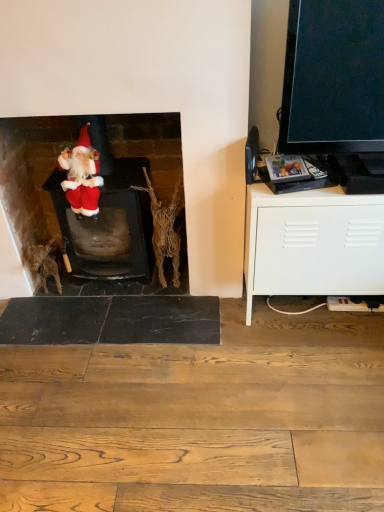
Question: Considering the relative sizes of velvet santa at left and fuzzy fabric santa at left in the image provided, is velvet santa at left wider than fuzzy fabric santa at left?

Choices:
 (A) yes
 (B) no

Answer: (A)

Question: Is velvet santa at left behind fuzzy fabric santa at left?

Choices:
 (A) no
 (B) yes

Answer: (B)

Question: Is velvet santa at left not inside fuzzy fabric santa at left?

Choices:
 (A) no
 (B) yes

Answer: (B)

Question: Considering the relative positions of velvet santa at left and fuzzy fabric santa at left in the image provided, is velvet santa at left in front of fuzzy fabric santa at left?

Choices:
 (A) no
 (B) yes

Answer: (A)

Question: Is velvet santa at left touching fuzzy fabric santa at left?

Choices:
 (A) yes
 (B) no

Answer: (B)

Question: From the image's perspective, is fuzzy fabric santa at left above or below velvet santa at left?

Choices:
 (A) below
 (B) above

Answer: (B)

Question: Based on their sizes in the image, would you say fuzzy fabric santa at left is bigger or smaller than velvet santa at left?

Choices:
 (A) big
 (B) small

Answer: (B)

Question: Choose the correct answer: Is fuzzy fabric santa at left inside velvet santa at left or outside it?

Choices:
 (A) outside
 (B) inside

Answer: (B)

Question: Considering the positions of point click(x=81, y=190) and point click(x=122, y=130), is point click(x=81, y=190) closer or farther from the camera than point click(x=122, y=130)?

Choices:
 (A) farther
 (B) closer

Answer: (B)

Question: Based on their sizes in the image, would you say velvet santa at left is bigger or smaller than fuzzy fabric santa at left?

Choices:
 (A) small
 (B) big

Answer: (B)

Question: Is velvet santa at left in front of or behind fuzzy fabric santa at left in the image?

Choices:
 (A) front
 (B) behind

Answer: (B)

Question: Visually, is velvet santa at left positioned to the left or to the right of fuzzy fabric santa at left?

Choices:
 (A) left
 (B) right

Answer: (B)

Question: From the image's perspective, is velvet santa at left positioned above or below fuzzy fabric santa at left?

Choices:
 (A) above
 (B) below

Answer: (B)

Question: Is velvet santa at left inside or outside of white matte cabinet at right?

Choices:
 (A) inside
 (B) outside

Answer: (B)

Question: In the image, is velvet santa at left positioned in front of or behind white matte cabinet at right?

Choices:
 (A) front
 (B) behind

Answer: (B)